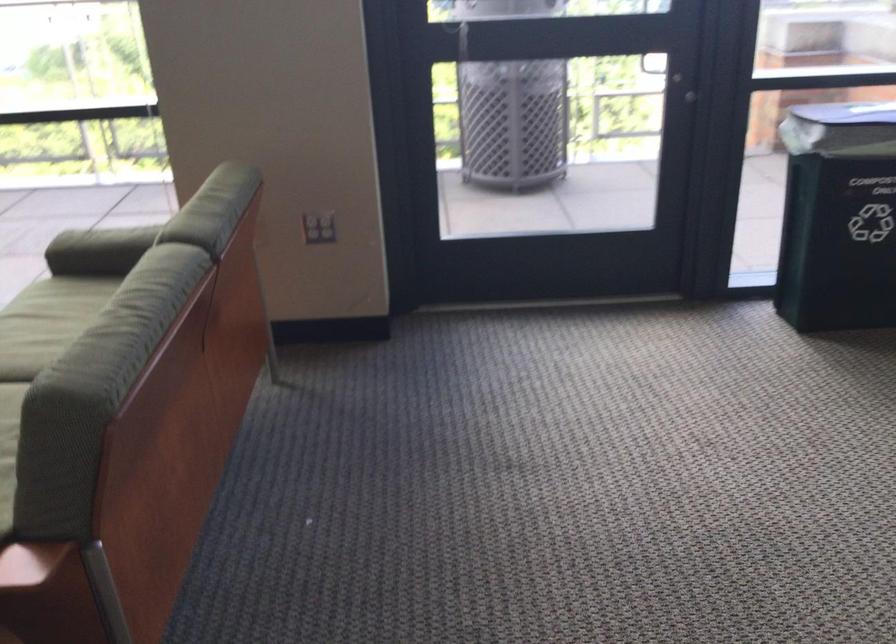
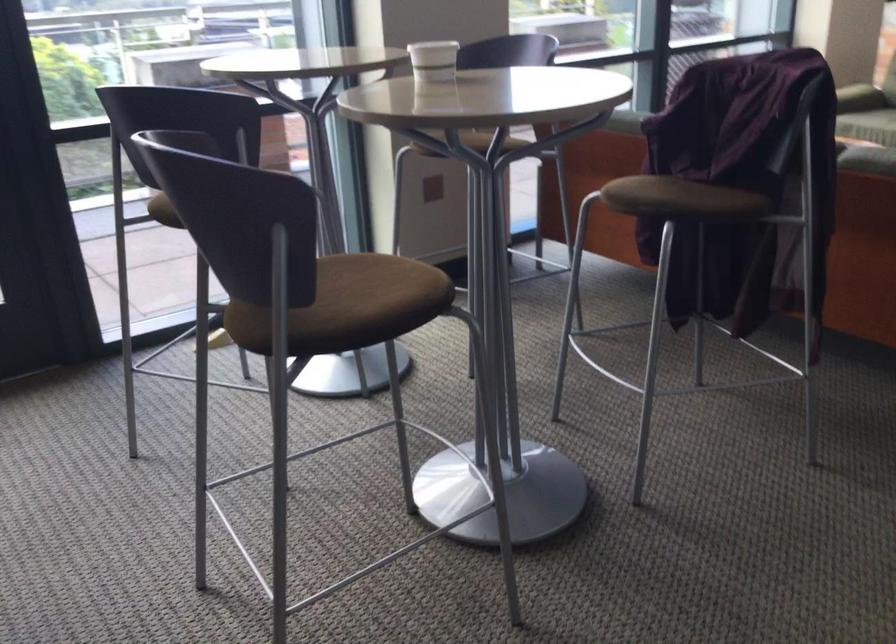
Question: I am providing you with two images of the same scene from different viewpoints. Which of the following objects are not visible in image2?

Choices:
 (A) green sofa armrest
 (B) small camera box
 (C) white paper cup
 (D) brown chair sitting surface

Answer: (A)